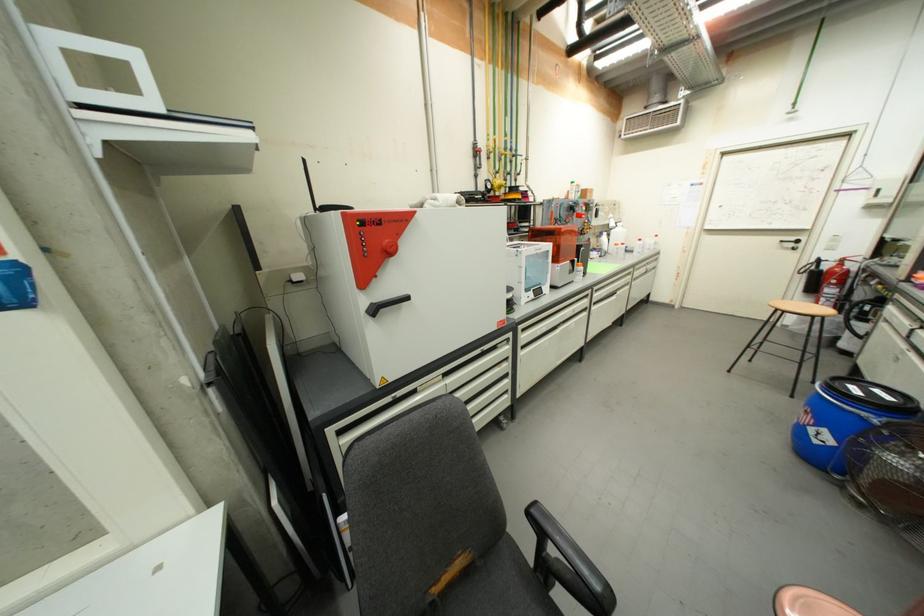
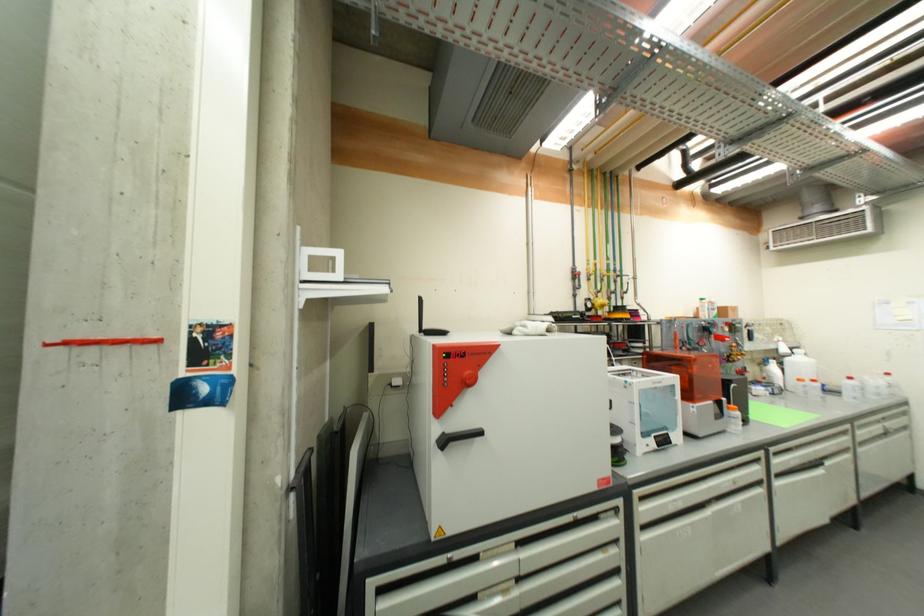
Locate, in the second image, the point that corresponds to point 377,305 in the first image.

(448, 435)